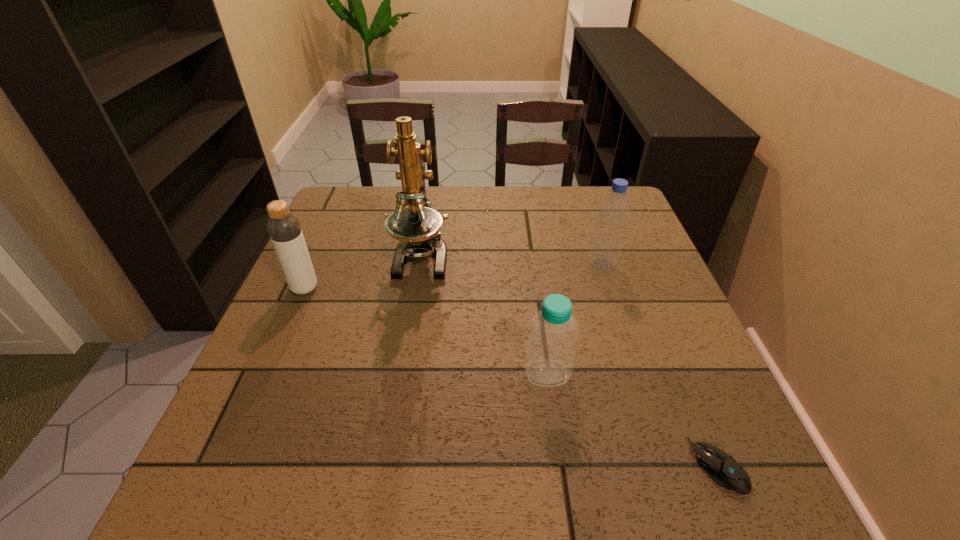
At what (x,y) coordinates should I click in order to perform the action: click on the tallest object. Please return your answer as a coordinate pair (x, y). The image size is (960, 540). Looking at the image, I should click on [x=417, y=227].

What are the coordinates of `microscope` in the screenshot? It's located at (417, 227).

You are a GUI agent. You are given a task and a screenshot of the screen. Output one action in this format:
    pyautogui.click(x=<x>, y=<y>)
    Task: Click on the farthest bottle
    The image size is (960, 540).
    Given the screenshot: What is the action you would take?
    pyautogui.click(x=614, y=210)

You are a GUI agent. You are given a task and a screenshot of the screen. Output one action in this format:
    pyautogui.click(x=<x>, y=<y>)
    Task: Click on the second object from right to left
    This screenshot has height=540, width=960.
    Given the screenshot: What is the action you would take?
    pyautogui.click(x=614, y=210)

Identify the location of the leftmost object. This screenshot has height=540, width=960. (284, 229).

The width and height of the screenshot is (960, 540). Find the location of `the leftmost bottle`. the leftmost bottle is located at coordinates (284, 229).

Find the location of a particular element. The image size is (960, 540). the nearest bottle is located at coordinates pos(549,357).

Find the location of a particular element. the fourth farthest object is located at coordinates (549, 357).

In order to click on computer mouse in this screenshot , I will do `click(721, 467)`.

Where is `the rightmost object`? the rightmost object is located at coordinates (721, 467).